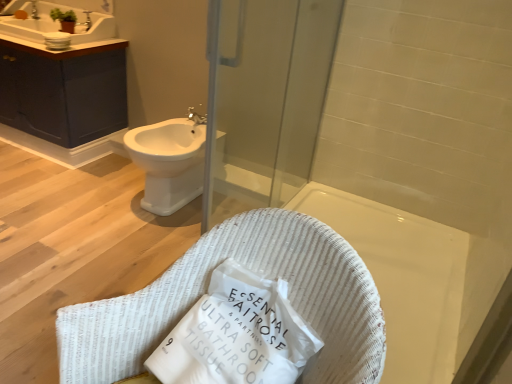
Question: Is matte dark blue cabinet at upper left bigger or smaller than silver metallic faucet at upper left, positioned as the second faucet in top-to-bottom order?

Choices:
 (A) small
 (B) big

Answer: (B)

Question: In terms of height, does matte dark blue cabinet at upper left look taller or shorter compared to silver metallic faucet at upper left, positioned as the second faucet in top-to-bottom order?

Choices:
 (A) short
 (B) tall

Answer: (B)

Question: Which object is positioned closest to the transparent glass screen door at upper center?

Choices:
 (A) white woven basket at center
 (B) silver metallic faucet at upper left, the first faucet positioned from the back
 (C) white glossy sink at upper left
 (D) matte dark blue cabinet at upper left
 (E) white paper tissue at center

Answer: (D)

Question: Which object is the farthest from the transparent glass screen door at upper center?

Choices:
 (A) white paper tissue at center
 (B) matte dark blue cabinet at upper left
 (C) white glossy sink at upper left
 (D) white glossy bidet at center left
 (E) white woven basket at center

Answer: (A)